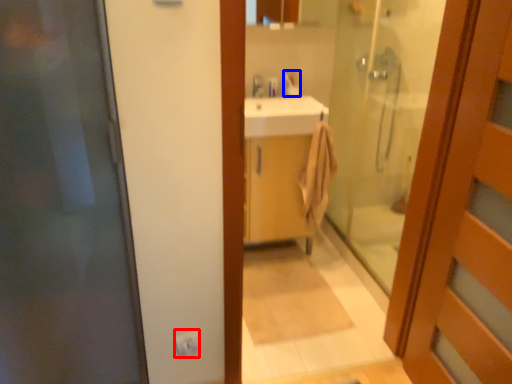
Question: Which of the following is the closest to the observer, electric outlet (highlighted by a red box) or toiletry (highlighted by a blue box)?

Choices:
 (A) electric outlet
 (B) toiletry

Answer: (A)